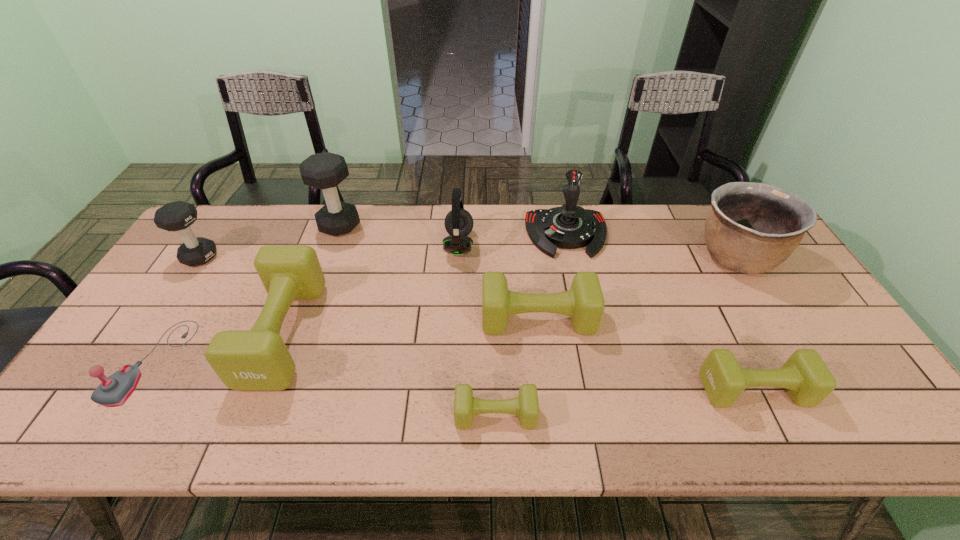
I want to click on headset located in the far edge section of the desktop, so click(x=458, y=222).

This screenshot has width=960, height=540. I want to click on joystick present at the near edge, so click(x=113, y=391).

Where is `dumbbell situated at the left edge`? The width and height of the screenshot is (960, 540). dumbbell situated at the left edge is located at coordinates (177, 216).

The height and width of the screenshot is (540, 960). In order to click on joystick that is at the left edge in this screenshot , I will do `click(113, 391)`.

You are a GUI agent. You are given a task and a screenshot of the screen. Output one action in this format:
    pyautogui.click(x=<x>, y=<y>)
    Task: Click on the object at the right edge
    The image size is (960, 540).
    Given the screenshot: What is the action you would take?
    tap(751, 228)

At what (x,y) coordinates should I click in order to perform the action: click on object present at the far left corner. Please return your answer as a coordinate pair (x, y). The image size is (960, 540). Looking at the image, I should click on (177, 216).

This screenshot has height=540, width=960. In order to click on object that is at the near left corner in this screenshot , I will do `click(113, 391)`.

The width and height of the screenshot is (960, 540). What are the coordinates of `object at the far right corner` in the screenshot? It's located at (751, 228).

Find the location of a particular element. The width and height of the screenshot is (960, 540). vacant space at the far edge of the desktop is located at coordinates (470, 235).

In the image, there is a desktop. Identify the location of free space at the near edge. This screenshot has width=960, height=540. (686, 433).